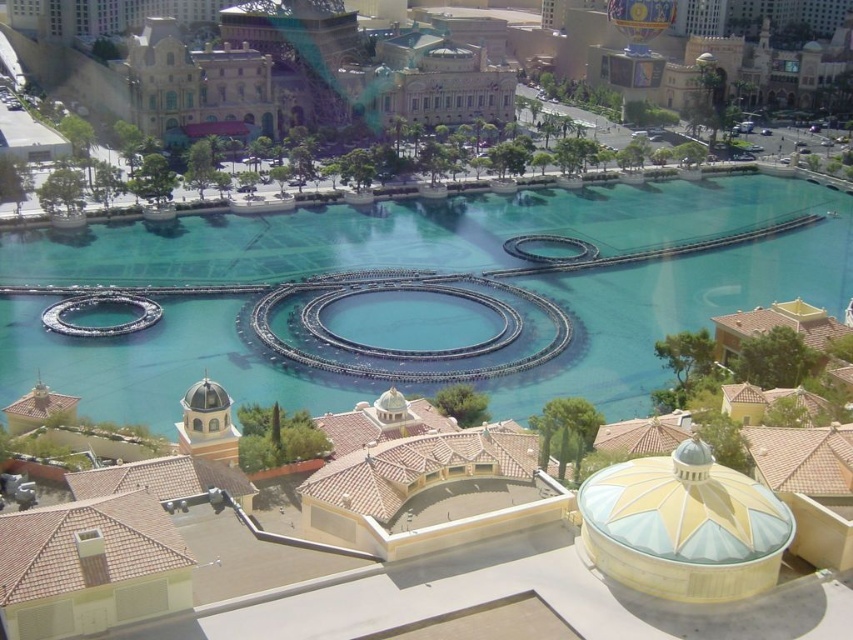
You are planning to take a photo of the clear blue water at center and the beige stone building at upper center. Which object will occupy more space in your photo?

The clear blue water at center will occupy more space in the photo because it is bigger than the beige stone building at upper center.

You are standing at the resort and want to take a photo of both the point at coordinates (688, 196) and the point at coordinates (189, 67). Which point will appear larger in your photo?

The point at coordinates (688, 196) will appear larger in the photo because it is closer to the viewer than the point at coordinates (189, 67).